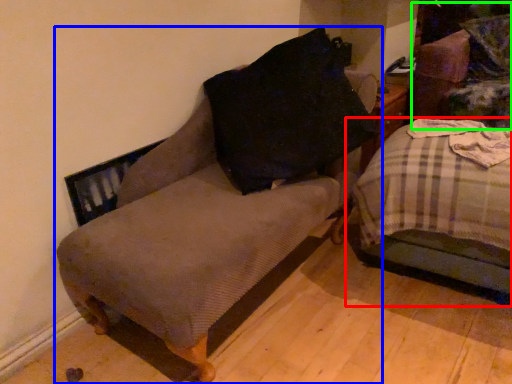
Question: Which is nearer to the studio couch (highlighted by a red box)? furniture (highlighted by a blue box) or swivel chair (highlighted by a green box).

Choices:
 (A) furniture
 (B) swivel chair

Answer: (A)